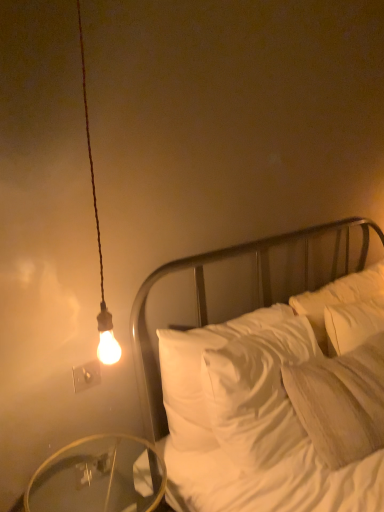
The height and width of the screenshot is (512, 384). What do you see at coordinates (86, 375) in the screenshot?
I see `white plastic electric outlet at upper left` at bounding box center [86, 375].

The width and height of the screenshot is (384, 512). Identify the location of transparent glass table at lower left. (96, 477).

How different are the orientations of white soft pillow at right and white plastic electric outlet at upper left in degrees?

4.03 degrees.

Considering the sizes of objects white soft pillow at right and white plastic electric outlet at upper left in the image provided, who is wider, white soft pillow at right or white plastic electric outlet at upper left?

Wider between the two is white soft pillow at right.

Considering the relative positions of white soft pillow at right and white plastic electric outlet at upper left in the image provided, is white soft pillow at right to the left of white plastic electric outlet at upper left from the viewer's perspective?

No, white soft pillow at right is not to the left of white plastic electric outlet at upper left.

The image size is (384, 512). I want to click on pillow above the white plastic electric outlet at upper left (from the image's perspective), so click(341, 402).

Based on their positions, is white satin bed at center located to the left or right of transparent glass table at lower left?

white satin bed at center is positioned on transparent glass table at lower left's right side.

Is white satin bed at center closer to the viewer compared to transparent glass table at lower left?

No, it is not.

Could transparent glass table at lower left be considered to be inside white satin bed at center?

No, transparent glass table at lower left is located outside of white satin bed at center.

From the image's perspective, is white plastic electric outlet at upper left above or below white satin bed at center?

Based on their image positions, white plastic electric outlet at upper left is located above white satin bed at center.

In terms of width, does white plastic electric outlet at upper left look wider or thinner when compared to white satin bed at center?

In the image, white plastic electric outlet at upper left appears to be more narrow than white satin bed at center.

Does point (88, 365) come behind point (380, 231)?

No, it is in front of (380, 231).

From a real-world perspective, is white plastic electric outlet at upper left physically above white satin bed at center?

Indeed, from a real-world perspective, white plastic electric outlet at upper left stands above white satin bed at center.

Does point (266, 293) appear closer or farther from the camera than point (86, 369)?

Point (266, 293) is positioned farther from the camera compared to point (86, 369).

Would you say white satin bed at center is inside or outside white plastic electric outlet at upper left?

white satin bed at center is not inside white plastic electric outlet at upper left, it's outside.

Which of these two, white satin bed at center or white plastic electric outlet at upper left, is smaller?

With smaller size is white plastic electric outlet at upper left.

Can you confirm if white satin bed at center is wider than white plastic electric outlet at upper left?

Yes, white satin bed at center is wider than white plastic electric outlet at upper left.

From the picture: Can you confirm if white satin bed at center is taller than white soft pillow at right?

Yes.

In the scene shown: How much distance is there between white satin bed at center and white soft pillow at right?

The distance of white satin bed at center from white soft pillow at right is 19.62 inches.

Is white satin bed at center in front of or behind white soft pillow at right in the image?

Result: Clearly, white satin bed at center is in front of white soft pillow at right.

Does white satin bed at center have a lesser width compared to white soft pillow at right?

Indeed, white satin bed at center has a lesser width compared to white soft pillow at right.

Can you confirm if white soft pillow at right is shorter than transparent glass table at lower left?

No.

Which is less distant, (x=382, y=397) or (x=53, y=494)?

Point (x=53, y=494)

Considering the positions of objects white soft pillow at right and transparent glass table at lower left in the image provided, who is behind, white soft pillow at right or transparent glass table at lower left?

Positioned behind is white soft pillow at right.

Is white soft pillow at right wider than white satin bed at center?

Yes.

Considering the sizes of objects white soft pillow at right and white satin bed at center in the image provided, who is smaller, white soft pillow at right or white satin bed at center?

Smaller between the two is white soft pillow at right.

Can you tell me how much white soft pillow at right and white satin bed at center differ in facing direction?

white soft pillow at right and white satin bed at center are facing 9.41 degrees away from each other.

Which of these two, white soft pillow at right or white satin bed at center, stands shorter?

Standing shorter between the two is white soft pillow at right.

At what (x,y) coordinates should I click in order to perform the action: click on pillow beneath the white plastic electric outlet at upper left (from a real-world perspective). Please return your answer as a coordinate pair (x, y). This screenshot has width=384, height=512. Looking at the image, I should click on (341, 402).

Where is `table in front of the white satin bed at center`? table in front of the white satin bed at center is located at coordinates (96, 477).

Which object lies further to the anchor point transparent glass table at lower left, white plastic electric outlet at upper left or white soft pillow at right?

white soft pillow at right lies further to transparent glass table at lower left than the other object.

Based on their spatial positions, is transparent glass table at lower left or white satin bed at center closer to white plastic electric outlet at upper left?

The object closer to white plastic electric outlet at upper left is transparent glass table at lower left.

From the picture: Estimate the real-world distances between objects in this image. Which object is further from transparent glass table at lower left, white satin bed at center or white soft pillow at right?

The object further to transparent glass table at lower left is white soft pillow at right.

Based on their spatial positions, is white soft pillow at right or transparent glass table at lower left further from white plastic electric outlet at upper left?

Among the two, white soft pillow at right is located further to white plastic electric outlet at upper left.

From the image, which object appears to be nearer to transparent glass table at lower left, white soft pillow at right or white plastic electric outlet at upper left?

The object closer to transparent glass table at lower left is white plastic electric outlet at upper left.

Which object lies nearer to the anchor point white satin bed at center, white soft pillow at right or transparent glass table at lower left?

Among the two, transparent glass table at lower left is located nearer to white satin bed at center.

When comparing their distances from white satin bed at center, does transparent glass table at lower left or white soft pillow at right seem further?

white soft pillow at right is positioned further to the anchor white satin bed at center.

Consider the image. When comparing their distances from white satin bed at center, does transparent glass table at lower left or white plastic electric outlet at upper left seem closer?

The object closer to white satin bed at center is transparent glass table at lower left.

Locate an element on the screen. bed located between white plastic electric outlet at upper left and white soft pillow at right in the left-right direction is located at coordinates (206, 300).

You are a GUI agent. You are given a task and a screenshot of the screen. Output one action in this format:
    pyautogui.click(x=<x>, y=<y>)
    Task: Click on the table between white plastic electric outlet at upper left and white soft pillow at right
    
    Given the screenshot: What is the action you would take?
    pyautogui.click(x=96, y=477)

This screenshot has width=384, height=512. What are the coordinates of `bed located between transparent glass table at lower left and white soft pillow at right in the left-right direction` in the screenshot? It's located at (206, 300).

This screenshot has width=384, height=512. I want to click on table between white plastic electric outlet at upper left and white satin bed at center in the horizontal direction, so click(96, 477).